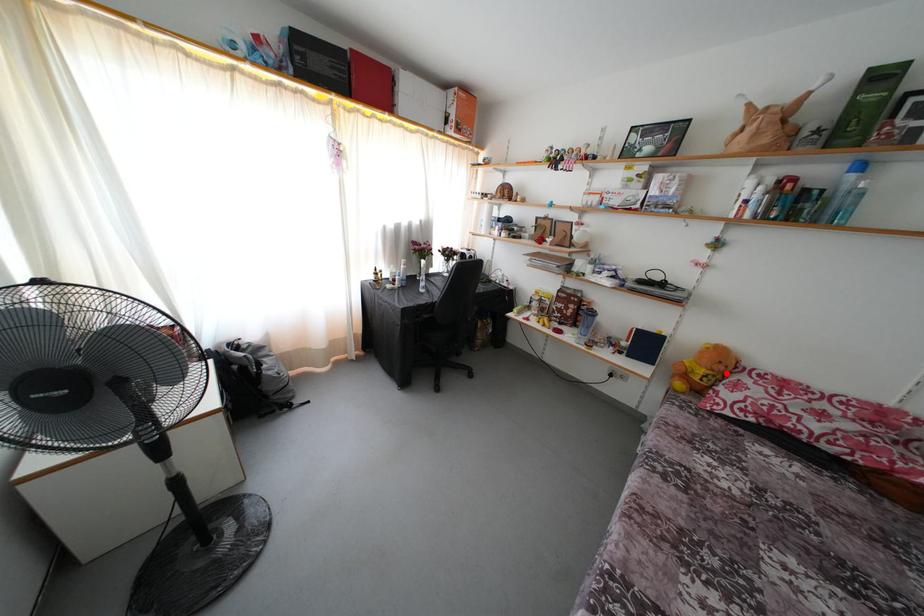
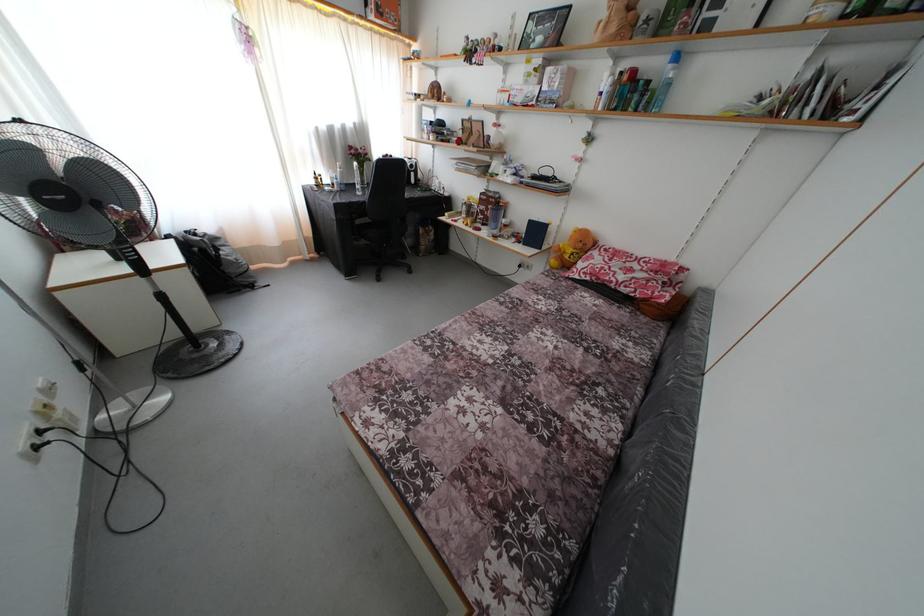
Question: I am providing you with two images of the same scene from different viewpoints. A red point is shown in image1. For the corresponding object point in image2, is it positioned nearer or farther from the camera?

Choices:
 (A) Nearer
 (B) Farther

Answer: (A)